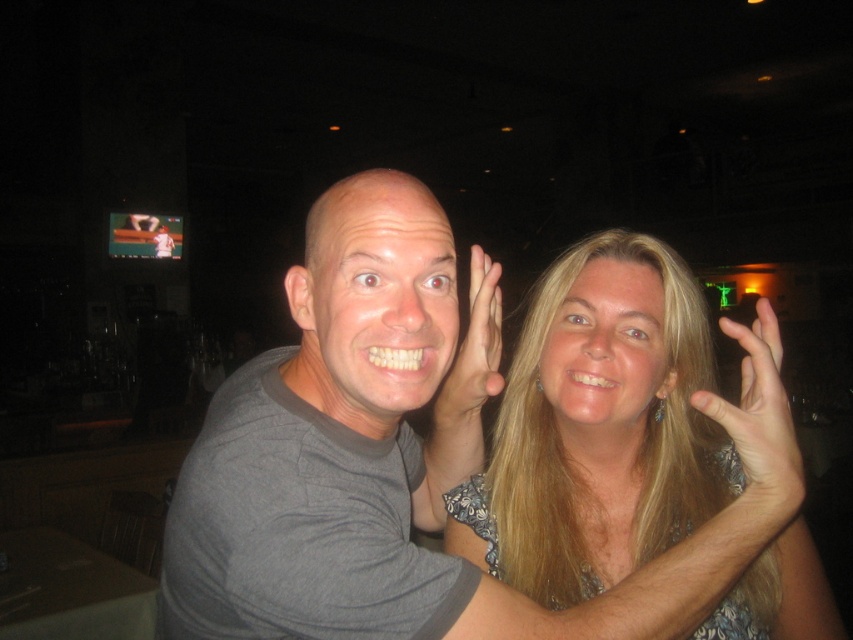
In the photo, there is a point marked at coordinates (410,464). Based on the scene description, what does this point most likely represent?

The point at (410,464) marks the location of the gray fabric couple at center.

You are taking a photo of two people in a dimly lit indoor setting. You notice two points in the image at coordinates point [312,477] and point [775,417]. Based on their positions, which point is closer to the camera?

Point [312,477] is closer to the camera than point [775,417].

Based on the scene description, can you determine the spatial relationship between the blonde hair at center and the smooth skin hand at upper right?

The blonde hair at center is located below the smooth skin hand at upper right.